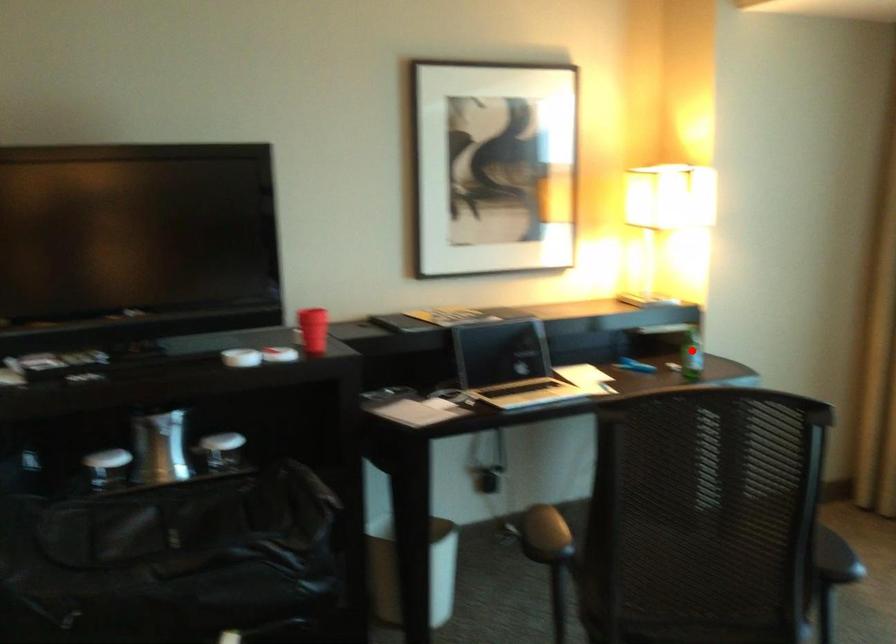
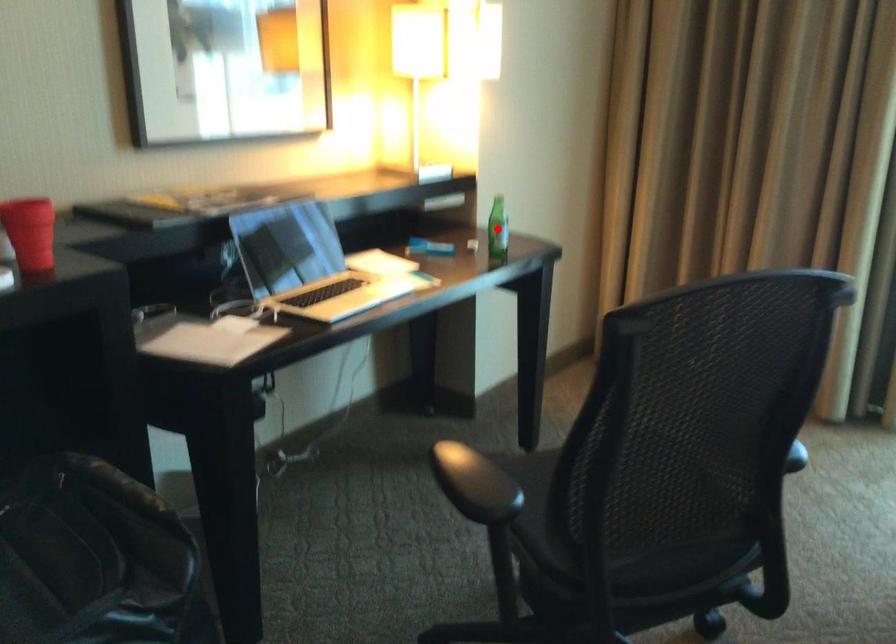
I am providing you with two images of the same scene from different viewpoints. A red point is marked on the first image and another point is marked on the second image. Is the marked point in image1 the same physical position as the marked point in image2?

Yes